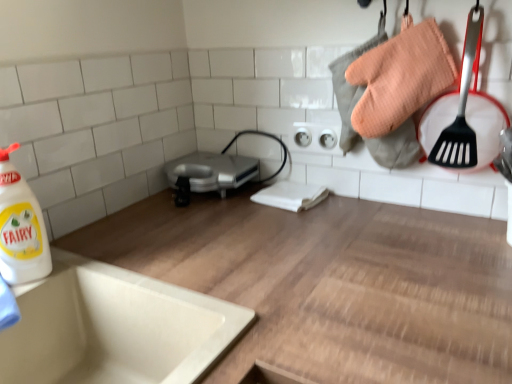
Describe the element at coordinates (113, 328) in the screenshot. I see `white ceramic sink at lower left` at that location.

In order to face white ceramic sink at lower left, should I rotate leftwards or rightwards?

Turn left approximately 20.866 degrees to face it.

What do you see at coordinates (211, 172) in the screenshot? This screenshot has height=384, width=512. I see `silver metallic toaster at center` at bounding box center [211, 172].

Image resolution: width=512 pixels, height=384 pixels. What do you see at coordinates (20, 227) in the screenshot?
I see `white glossy bottle at left` at bounding box center [20, 227].

Find the location of a particular element. white ceramic sink at lower left is located at coordinates (113, 328).

Is silver metallic toaster at center taller or shorter than white glossy bottle at left?

In the image, silver metallic toaster at center appears to be shorter than white glossy bottle at left.

Is white glossy bottle at left inside silver metallic toaster at center?

Definitely not — white glossy bottle at left is not inside silver metallic toaster at center.

Which object is positioned more to the right, silver metallic toaster at center or white glossy bottle at left?

silver metallic toaster at center.

Are silver metallic toaster at center and white glossy bottle at left making contact?

silver metallic toaster at center is not next to white glossy bottle at left, and they're not touching.

Which is behind, silver metallic toaster at center or white ceramic sink at lower left?

Positioned behind is silver metallic toaster at center.

Locate an element on the screen. sink that is below the silver metallic toaster at center (from the image's perspective) is located at coordinates (113, 328).

From a real-world perspective, relative to white ceramic sink at lower left, is silver metallic toaster at center vertically above or below?

silver metallic toaster at center is above white ceramic sink at lower left.

Is silver metallic toaster at center far from white ceramic sink at lower left?

No, silver metallic toaster at center is not far from white ceramic sink at lower left.

Which is in front, point (291, 346) or point (199, 181)?

Positioned in front is point (291, 346).

From the image's perspective, is wooden at upper center positioned above or below silver metallic toaster at center?

Clearly, from the image's perspective, wooden at upper center is below silver metallic toaster at center.

Is wooden at upper center turned away from silver metallic toaster at center?

No, wooden at upper center is not facing the opposite direction of silver metallic toaster at center.

Considering the sizes of objects wooden at upper center and silver metallic toaster at center in the image provided, who is wider, wooden at upper center or silver metallic toaster at center?

wooden at upper center.

In the scene shown: Which of these two, white ceramic sink at lower left or wooden at upper center, is wider?

wooden at upper center.

Based on their positions, is white ceramic sink at lower left located to the left or right of wooden at upper center?

In the image, white ceramic sink at lower left appears on the left side of wooden at upper center.

Considering the sizes of objects white ceramic sink at lower left and wooden at upper center in the image provided, who is shorter, white ceramic sink at lower left or wooden at upper center?

With less height is white ceramic sink at lower left.

From the image's perspective, would you say white ceramic sink at lower left is positioned over wooden at upper center?

Correct, white ceramic sink at lower left appears higher than wooden at upper center in the image.

How distant is white ceramic sink at lower left from silver metallic toaster at center?

46.86 centimeters.

Which is behind, white ceramic sink at lower left or silver metallic toaster at center?

silver metallic toaster at center is further away from the camera.

In the scene shown: Is white ceramic sink at lower left wider or thinner than silver metallic toaster at center?

Considering their sizes, white ceramic sink at lower left looks broader than silver metallic toaster at center.

Which object is further away from the camera taking this photo, white glossy bottle at left or silver metallic toaster at center?

silver metallic toaster at center is further away from the camera.

Is white glossy bottle at left oriented towards silver metallic toaster at center?

No, white glossy bottle at left is not facing towards silver metallic toaster at center.

What's the angular difference between white glossy bottle at left and silver metallic toaster at center's facing directions?

white glossy bottle at left and silver metallic toaster at center are facing 89.3 degrees away from each other.

Who is taller, white glossy bottle at left or silver metallic toaster at center?

white glossy bottle at left.

Which of these two, wooden at upper center or white ceramic sink at lower left, is smaller?

With smaller size is white ceramic sink at lower left.

Where is `sink behind the wooden at upper center`? The image size is (512, 384). sink behind the wooden at upper center is located at coordinates (113, 328).

From the image's perspective, is wooden at upper center located above white ceramic sink at lower left?

Incorrect, from the image's perspective, wooden at upper center is lower than white ceramic sink at lower left.

Is wooden at upper center to the right of white ceramic sink at lower left from the viewer's perspective?

Yes.

Where is `appliance behind the white glossy bottle at left`? This screenshot has width=512, height=384. appliance behind the white glossy bottle at left is located at coordinates click(211, 172).

This screenshot has width=512, height=384. Find the location of `appliance above the white ceramic sink at lower left (from the image's perspective)`. appliance above the white ceramic sink at lower left (from the image's perspective) is located at coordinates click(x=211, y=172).

From the picture: When comparing their distances from wooden at upper center, does white ceramic sink at lower left or silver metallic toaster at center seem further?

silver metallic toaster at center is further to wooden at upper center.

Looking at this image, looking at the image, which one is located further to wooden at upper center, white glossy bottle at left or silver metallic toaster at center?

The object further to wooden at upper center is white glossy bottle at left.

Looking at this image, considering their positions, is silver metallic toaster at center positioned further to white ceramic sink at lower left than white glossy bottle at left?

silver metallic toaster at center.

When comparing their distances from wooden at upper center, does white glossy bottle at left or white ceramic sink at lower left seem closer?

white ceramic sink at lower left lies closer to wooden at upper center than the other object.

Considering their positions, is wooden at upper center positioned closer to white ceramic sink at lower left than silver metallic toaster at center?

wooden at upper center lies closer to white ceramic sink at lower left than the other object.

Estimate the real-world distances between objects in this image. Which object is further from white glossy bottle at left, wooden at upper center or white ceramic sink at lower left?

wooden at upper center is further to white glossy bottle at left.

Looking at the image, which one is located further to white glossy bottle at left, white ceramic sink at lower left or silver metallic toaster at center?

Among the two, silver metallic toaster at center is located further to white glossy bottle at left.

Based on the photo, from the image, which object appears to be farther from silver metallic toaster at center, white glossy bottle at left or wooden at upper center?

white glossy bottle at left is further to silver metallic toaster at center.

Where is `cleaning product between white ceramic sink at lower left and silver metallic toaster at center from front to back`? This screenshot has width=512, height=384. cleaning product between white ceramic sink at lower left and silver metallic toaster at center from front to back is located at coordinates (20, 227).

Find the location of a particular element. cleaning product between wooden at upper center and silver metallic toaster at center from front to back is located at coordinates (20, 227).

I want to click on sink between white glossy bottle at left and wooden at upper center, so click(113, 328).

Locate an element on the screen. This screenshot has width=512, height=384. sink between wooden at upper center and silver metallic toaster at center in the front-back direction is located at coordinates (113, 328).